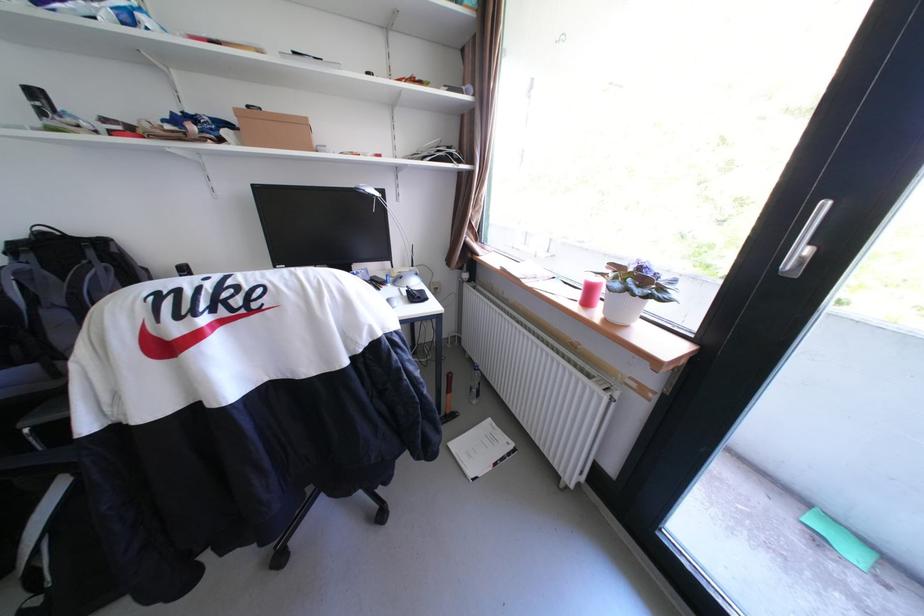
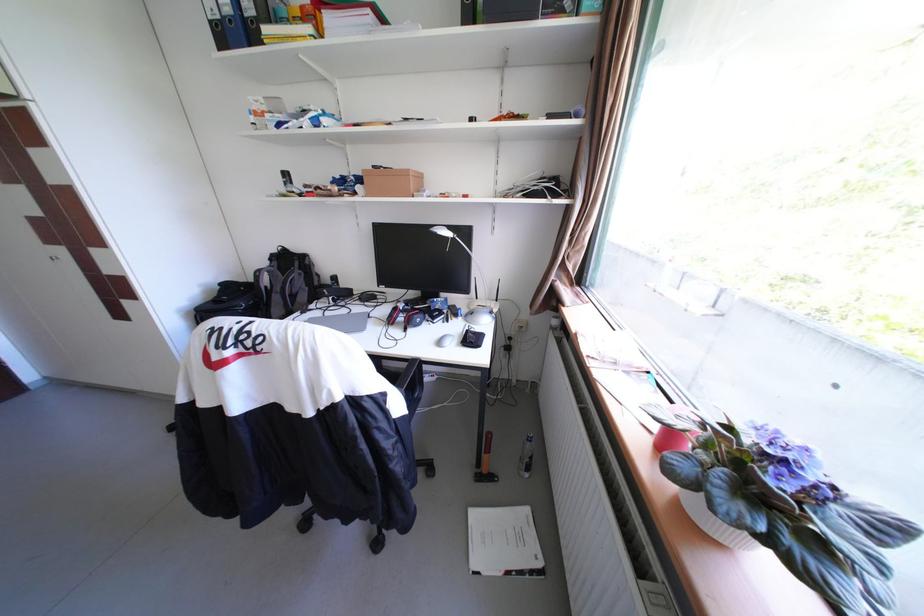
Question: Based on the continuous images, in which direction is the camera rotating? Reply with the corresponding letter.

Choices:
 (A) Left
 (B) Right
 (C) Up
 (D) Down

Answer: (A)